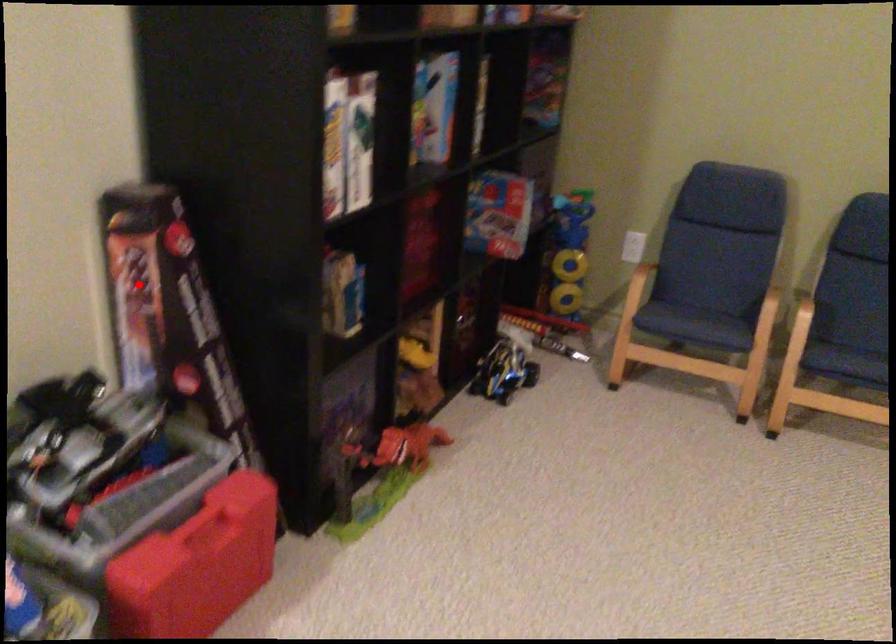
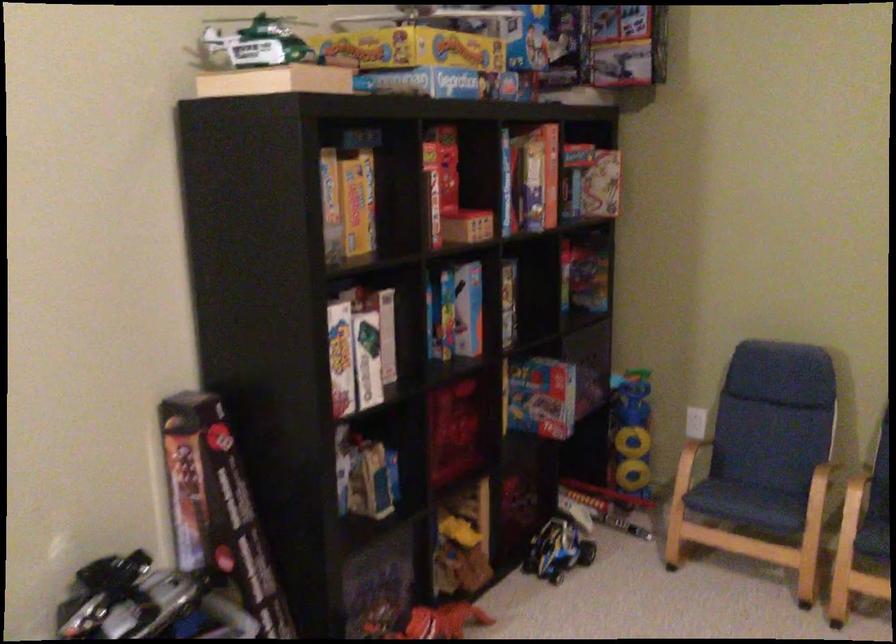
Locate, in the second image, the point that corresponds to the highlighted location in the first image.

(186, 471)